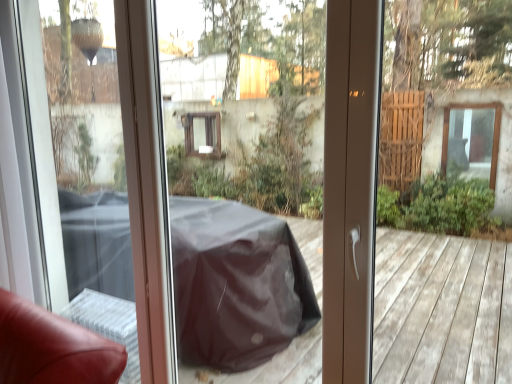
Measure the distance between transparent plastic screen door at left and camera.

transparent plastic screen door at left and camera are 5.23 feet apart from each other.

Describe the element at coordinates (146, 187) in the screenshot. I see `transparent plastic screen door at left` at that location.

Where is `transparent plastic screen door at left`? transparent plastic screen door at left is located at coordinates (146, 187).

What is the approximate height of transparent plastic screen door at left?

It is 1.82 meters.

The image size is (512, 384). In order to click on transparent plastic screen door at left in this screenshot , I will do `click(146, 187)`.